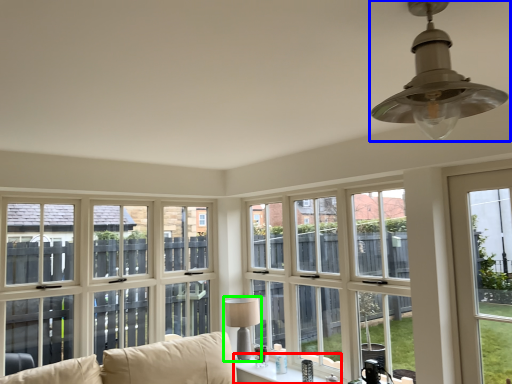
Question: Which object is positioned closest to window (highlighted by a red box)? Select from lamp (highlighted by a blue box) and lamp (highlighted by a green box).

Choices:
 (A) lamp
 (B) lamp

Answer: (B)